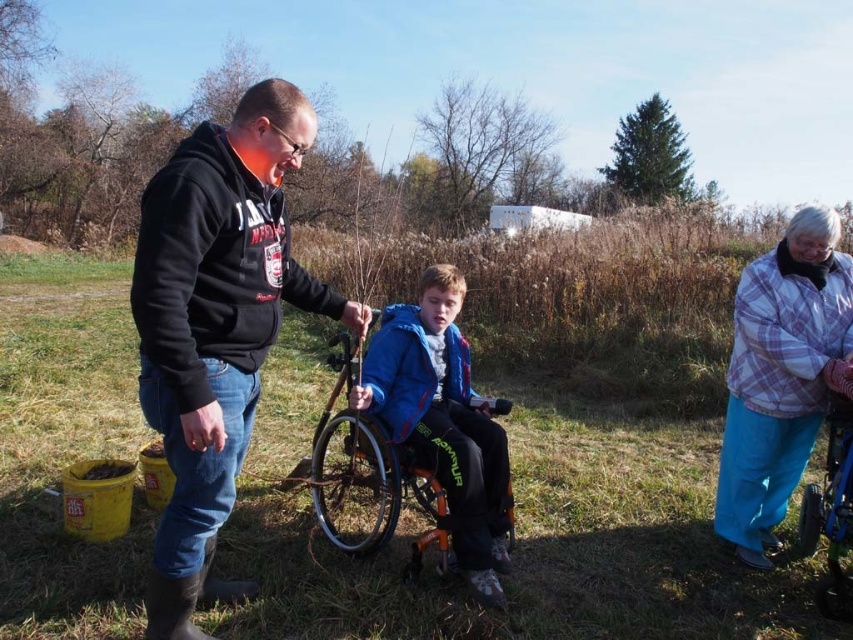
Question: Does orange metallic wheelchair at center have a larger size compared to blue plastic wheelchair at lower right?

Choices:
 (A) no
 (B) yes

Answer: (B)

Question: Estimate the real-world distances between objects in this image. Which object is farther from the blue plastic wheelchair at lower right?

Choices:
 (A) black matte hoodie at center
 (B) plaid fabric jacket at lower right
 (C) orange metallic wheelchair at center

Answer: (A)

Question: Which point is farther from the camera taking this photo?

Choices:
 (A) (844, 548)
 (B) (741, 548)

Answer: (B)

Question: Is plaid fabric jacket at lower right to the right of blue plastic wheelchair at lower right from the viewer's perspective?

Choices:
 (A) no
 (B) yes

Answer: (A)

Question: Considering the real-world distances, which object is closest to the black matte hoodie at center?

Choices:
 (A) orange metallic wheelchair at center
 (B) blue plastic wheelchair at lower right

Answer: (A)

Question: Does black matte hoodie at center lie in front of blue plastic wheelchair at lower right?

Choices:
 (A) no
 (B) yes

Answer: (B)